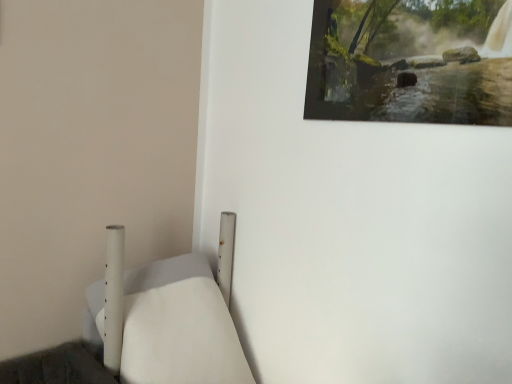
Describe the element at coordinates (410, 62) in the screenshot. This screenshot has width=512, height=384. I see `wooden painting at upper right` at that location.

Where is `wooden painting at upper right`? This screenshot has width=512, height=384. wooden painting at upper right is located at coordinates (410, 62).

The height and width of the screenshot is (384, 512). Describe the element at coordinates (168, 317) in the screenshot. I see `white matte bed at lower left` at that location.

You are a GUI agent. You are given a task and a screenshot of the screen. Output one action in this format:
    pyautogui.click(x=<x>, y=<y>)
    Task: Click on the white matte bed at lower left
    
    Given the screenshot: What is the action you would take?
    pyautogui.click(x=168, y=317)

Find the location of a particular element. The width and height of the screenshot is (512, 384). wooden painting at upper right is located at coordinates (410, 62).

Would you say white matte bed at lower left is to the left or to the right of wooden painting at upper right in the picture?

Based on their positions, white matte bed at lower left is located to the left of wooden painting at upper right.

Looking at this image, which object is closer to the camera, white matte bed at lower left or wooden painting at upper right?

white matte bed at lower left is in front.

Considering the points (187, 324) and (497, 49), which point is behind, point (187, 324) or point (497, 49)?

The point (187, 324) is farther from the camera.

From the image's perspective, is white matte bed at lower left located above or below wooden painting at upper right?

white matte bed at lower left is below wooden painting at upper right.

From a real-world perspective, is white matte bed at lower left located higher than wooden painting at upper right?

No.

Between white matte bed at lower left and wooden painting at upper right, which one has larger width?

With larger width is white matte bed at lower left.

Considering the sizes of white matte bed at lower left and wooden painting at upper right in the image, is white matte bed at lower left taller or shorter than wooden painting at upper right?

Considering their sizes, white matte bed at lower left has more height than wooden painting at upper right.

Considering the sizes of objects white matte bed at lower left and wooden painting at upper right in the image provided, who is bigger, white matte bed at lower left or wooden painting at upper right?

Bigger between the two is white matte bed at lower left.

Can wooden painting at upper right be found inside white matte bed at lower left?

No, wooden painting at upper right is located outside of white matte bed at lower left.

Is white matte bed at lower left not close to wooden painting at upper right?

No, there isn't a large distance between white matte bed at lower left and wooden painting at upper right.

Does white matte bed at lower left turn towards wooden painting at upper right?

No.

What's the angular difference between white matte bed at lower left and wooden painting at upper right's facing directions?

There is a 90.8-degree angle between the facing directions of white matte bed at lower left and wooden painting at upper right.

Where is `furniture to the left of wooden painting at upper right`? Image resolution: width=512 pixels, height=384 pixels. furniture to the left of wooden painting at upper right is located at coordinates (168, 317).

Consider the image. Is wooden painting at upper right at the left side of white matte bed at lower left?

In fact, wooden painting at upper right is to the right of white matte bed at lower left.

In the image, is wooden painting at upper right positioned in front of or behind white matte bed at lower left?

wooden painting at upper right is positioned farther from the viewer than white matte bed at lower left.

Which is nearer, (324, 8) or (220, 239)?

Point (324, 8) is positioned closer to the camera compared to point (220, 239).

Consider the image. From the image's perspective, relative to white matte bed at lower left, is wooden painting at upper right above or below?

Based on their image positions, wooden painting at upper right is located above white matte bed at lower left.

From a real-world perspective, is wooden painting at upper right physically located above or below white matte bed at lower left?

In terms of real-world spatial position, wooden painting at upper right is above white matte bed at lower left.

Looking at this image, considering the sizes of objects wooden painting at upper right and white matte bed at lower left in the image provided, who is thinner, wooden painting at upper right or white matte bed at lower left?

With smaller width is wooden painting at upper right.

Is wooden painting at upper right taller than white matte bed at lower left?

In fact, wooden painting at upper right may be shorter than white matte bed at lower left.

Which of these two, wooden painting at upper right or white matte bed at lower left, is bigger?

white matte bed at lower left is bigger.

Would you say wooden painting at upper right is inside or outside white matte bed at lower left?

wooden painting at upper right is outside white matte bed at lower left.

Is wooden painting at upper right beside white matte bed at lower left?

No.

Does wooden painting at upper right turn towards white matte bed at lower left?

No, wooden painting at upper right does not turn towards white matte bed at lower left.

What's the angular difference between wooden painting at upper right and white matte bed at lower left's facing directions?

The angular difference between wooden painting at upper right and white matte bed at lower left is 90.8 degrees.

The image size is (512, 384). I want to click on picture frame on the right of white matte bed at lower left, so click(x=410, y=62).

Find the location of a particular element. picture frame above the white matte bed at lower left (from the image's perspective) is located at coordinates (410, 62).

Locate an element on the screen. picture frame behind the white matte bed at lower left is located at coordinates (410, 62).